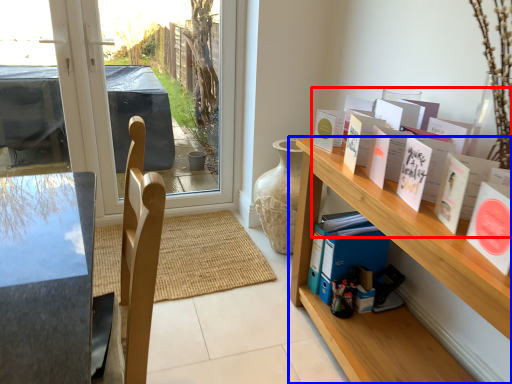
Question: Which object is further to the camera taking this photo, book (highlighted by a red box) or shelf (highlighted by a blue box)?

Choices:
 (A) book
 (B) shelf

Answer: (B)